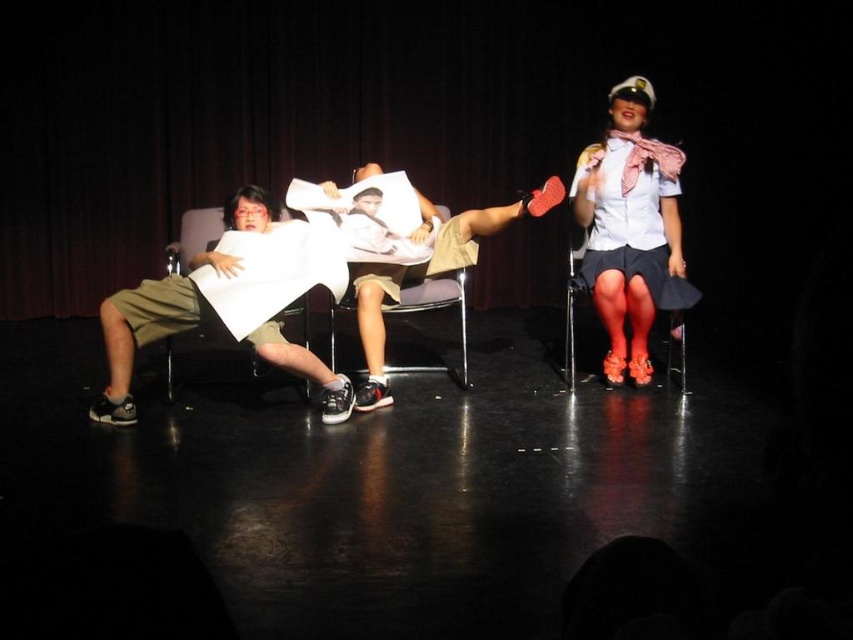
You are an actor standing on the stage. You need to move from the black leather chair at left to the metallic silver chair at center. Which direction should you move?

You should move to the right because the metallic silver chair at center is to the right of the black leather chair at left.